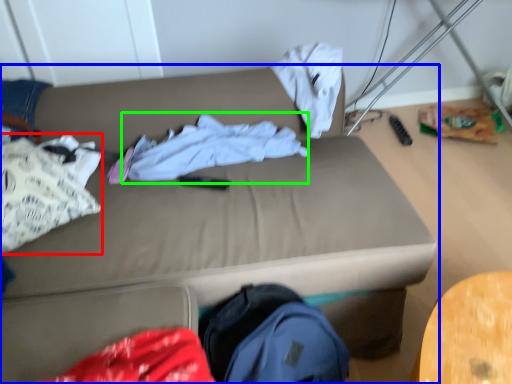
Question: Which object is positioned closest to clothing (highlighted by a red box)? Select from studio couch (highlighted by a blue box) and clothing (highlighted by a green box).

Choices:
 (A) studio couch
 (B) clothing

Answer: (A)